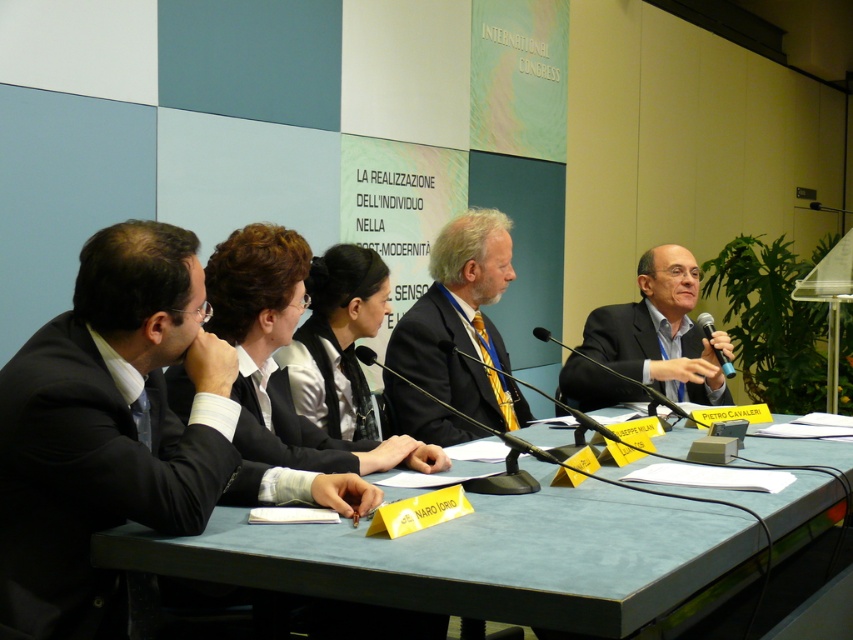
You are organizing a photoshoot and need to place a white dress on the table between the black satin suit at left and the black matte suit at center. Which side should you place it to ensure it is between them?

The black satin suit at left is to the left of the black matte suit at center, so placing the white dress between them would require positioning it to the right of the black satin suit at left and to the left of the black matte suit at center.

You are an attendee at the congress and want to approach the table to ask a question. You see the black satin suit at left and the black plastic microphone at right. Which object is closer to you as you stand in front of the table?

The black satin suit at left is closer to you because it is nearer to the viewer than the black plastic microphone at right.